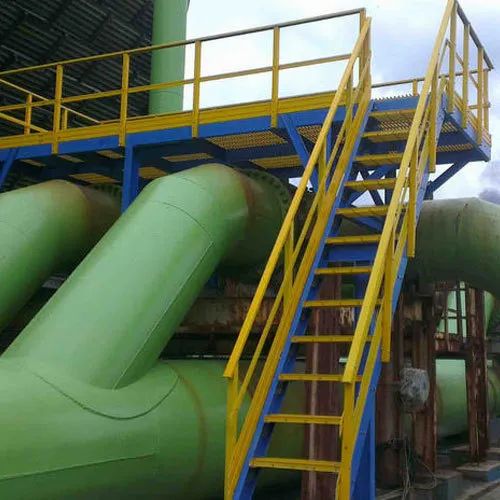
The image size is (500, 500). In order to click on 6th stair in this screenshot , I will do `click(363, 272)`.